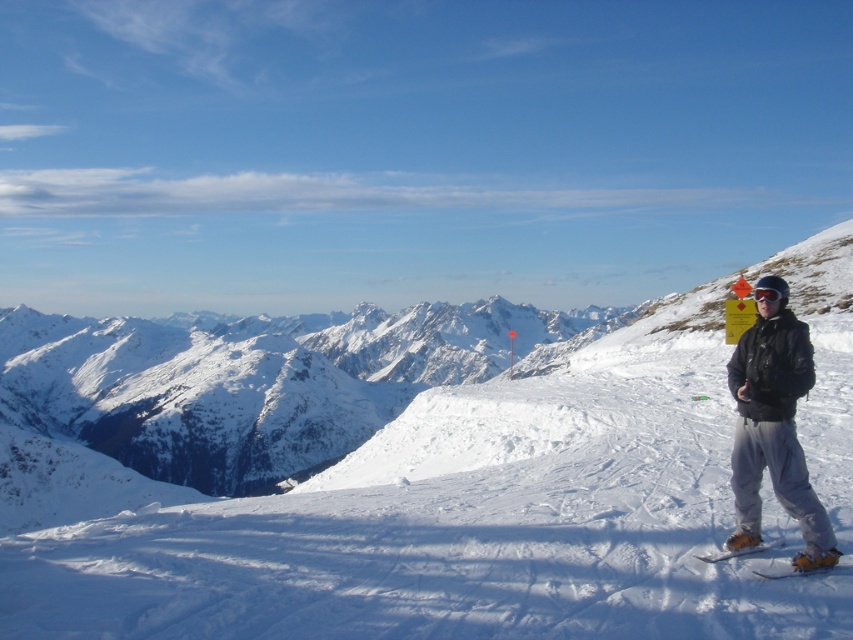
Question: Is white powdery snow at center bigger than yellow matte snowboard at lower right?

Choices:
 (A) yes
 (B) no

Answer: (A)

Question: Does white powdery snow at center have a larger size compared to yellow plastic snowboard at lower right?

Choices:
 (A) yes
 (B) no

Answer: (A)

Question: Which point is farther to the camera?

Choices:
 (A) yellow plastic snowboard at lower right
 (B) yellow matte snowboard at lower right

Answer: (A)

Question: Among these points, which one is nearest to the camera?

Choices:
 (A) (546, 596)
 (B) (799, 573)
 (C) (778, 538)

Answer: (B)

Question: Does black matte jacket at right appear on the left side of yellow plastic snowboard at lower right?

Choices:
 (A) no
 (B) yes

Answer: (A)

Question: Considering the real-world distances, which object is closest to the yellow plastic snowboard at lower right?

Choices:
 (A) white powdery snow at center
 (B) black matte goggles at right

Answer: (B)